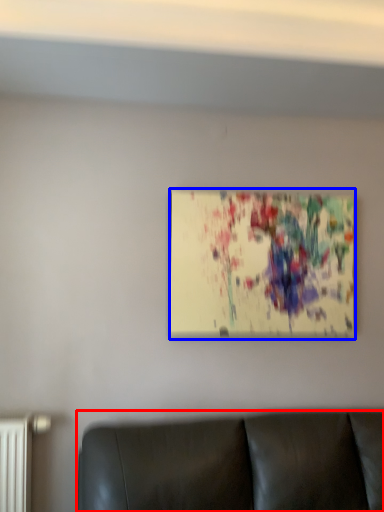
Question: Among these objects, which one is nearest to the camera, furniture (highlighted by a red box) or picture frame (highlighted by a blue box)?

Choices:
 (A) furniture
 (B) picture frame

Answer: (A)